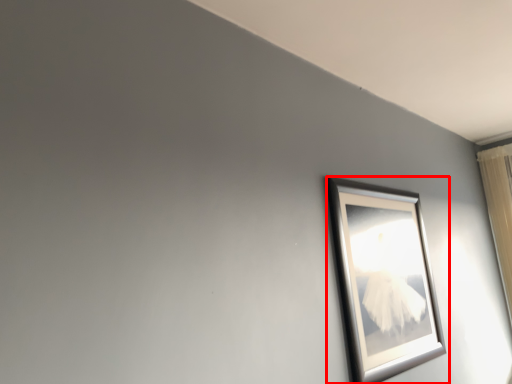
Question: From the image's perspective, what is the correct spatial relationship of picture frame (annotated by the red box) in relation to curtain?

Choices:
 (A) above
 (B) below

Answer: (B)